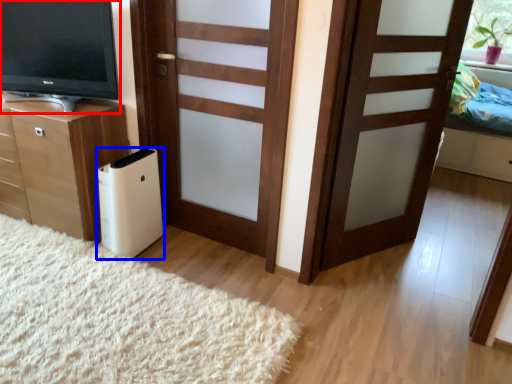
Question: Which object appears farthest to the camera in this image, television (highlighted by a red box) or appliance (highlighted by a blue box)?

Choices:
 (A) television
 (B) appliance

Answer: (B)